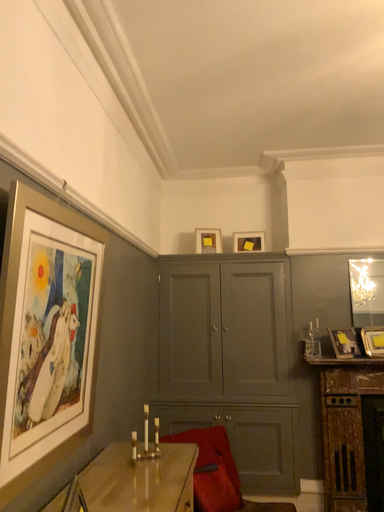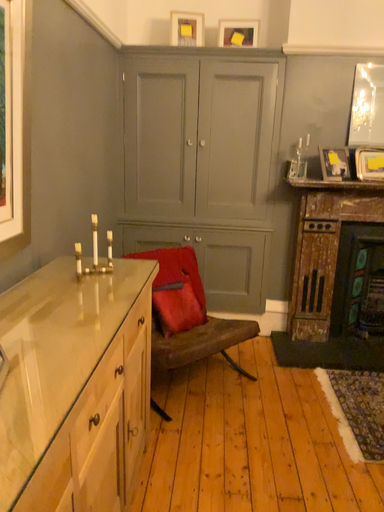
Question: Which way did the camera rotate in the video?

Choices:
 (A) rotated downward
 (B) rotated upward

Answer: (A)